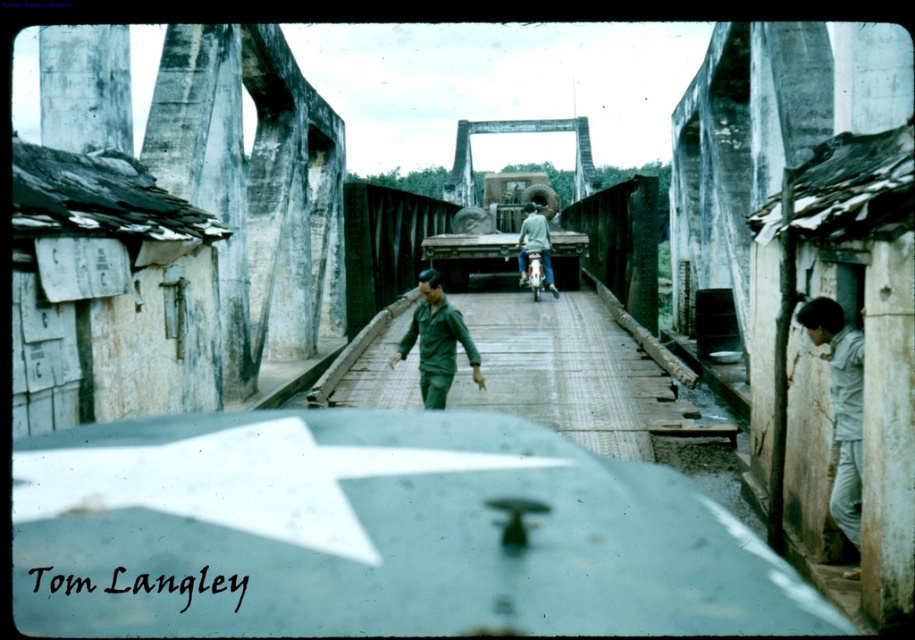
Question: Is weathered wood hut at left bigger than green matte uniform at center?

Choices:
 (A) yes
 (B) no

Answer: (A)

Question: Is weathered wood hut at left smaller than gray fabric shirt at right?

Choices:
 (A) no
 (B) yes

Answer: (A)

Question: Does weathered wood hut at left have a larger size compared to green matte uniform at center?

Choices:
 (A) no
 (B) yes

Answer: (B)

Question: Which object is closer to the camera taking this photo?

Choices:
 (A) concrete bridge at center
 (B) green matte uniform at center
 (C) gray fabric shirt at right

Answer: (C)

Question: Among these objects, which one is farthest from the camera?

Choices:
 (A) green matte uniform at center
 (B) gray fabric jacket at center

Answer: (B)

Question: Considering the real-world distances, which object is closest to the gray fabric shirt at right?

Choices:
 (A) green matte uniform at center
 (B) concrete bridge at center

Answer: (A)